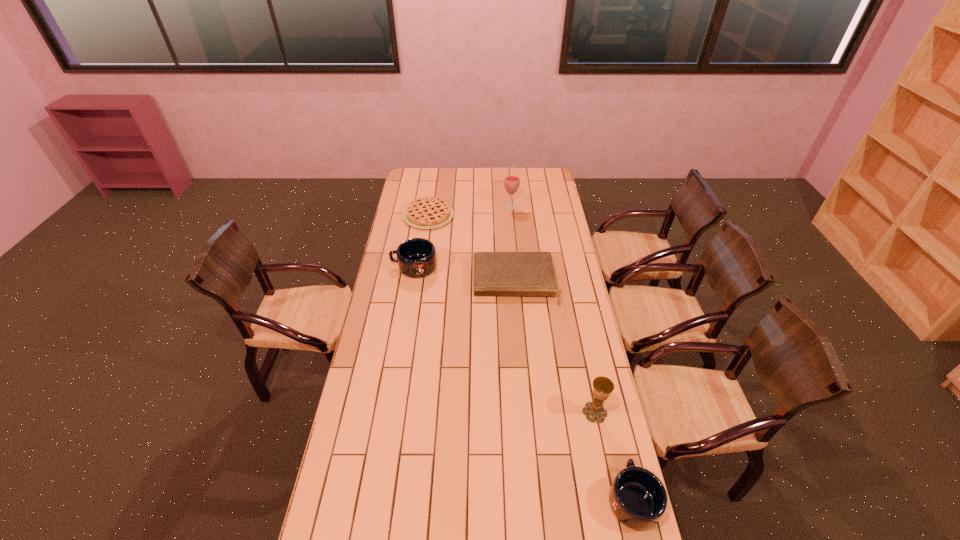
To achieve uniform spacing by inserting another mug among them, please point to a free space for this new mug. Please provide its 2D coordinates. Your answer should be formatted as a tuple, i.e. [(x, y)], where the tuple contains the x and y coordinates of a point satisfying the conditions above.

[(499, 356)]